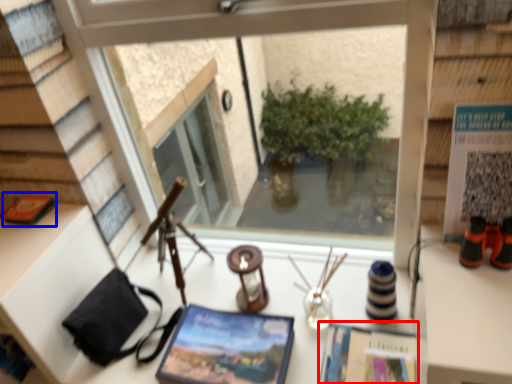
Question: Which object is closer to the camera taking this photo, magazine (highlighted by a red box) or book (highlighted by a blue box)?

Choices:
 (A) magazine
 (B) book

Answer: (A)